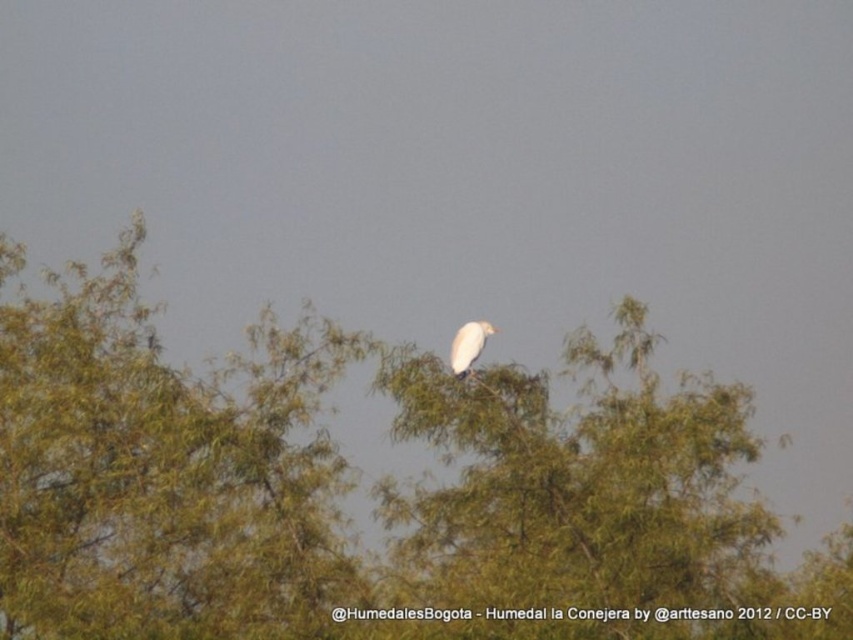
Is green leafy tree at center positioned at the back of white matte bird at center?

That is True.

The height and width of the screenshot is (640, 853). Describe the element at coordinates (373, 490) in the screenshot. I see `green leafy tree at center` at that location.

Is point (281, 353) closer to camera compared to point (467, 371)?

No, it is not.

The image size is (853, 640). What are the coordinates of `green leafy tree at center` in the screenshot? It's located at (373, 490).

Who is positioned more to the right, green leafy tree at center or green leafy tree at upper center?

Positioned to the right is green leafy tree at center.

Is green leafy tree at center closer to the viewer compared to green leafy tree at upper center?

Yes, green leafy tree at center is in front of green leafy tree at upper center.

Is point (16, 582) closer to viewer compared to point (148, 637)?

No, it is behind (148, 637).

Locate an element on the screen. The image size is (853, 640). green leafy tree at center is located at coordinates (373, 490).

Is point (262, 497) closer to viewer compared to point (471, 346)?

No, (262, 497) is further to viewer.

Does point (68, 387) lie behind point (451, 346)?

That is True.

Find the location of a particular element. The image size is (853, 640). green leafy tree at upper center is located at coordinates (161, 472).